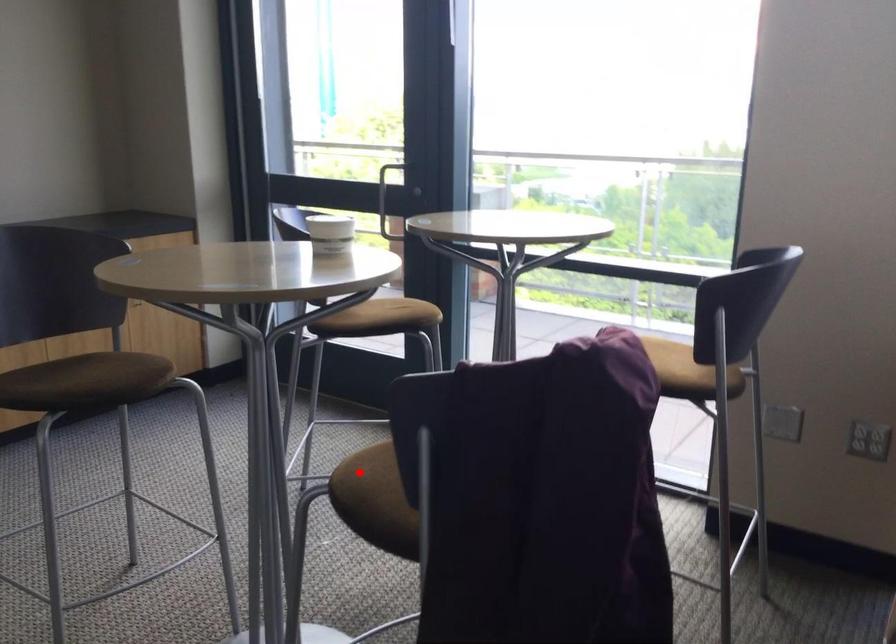
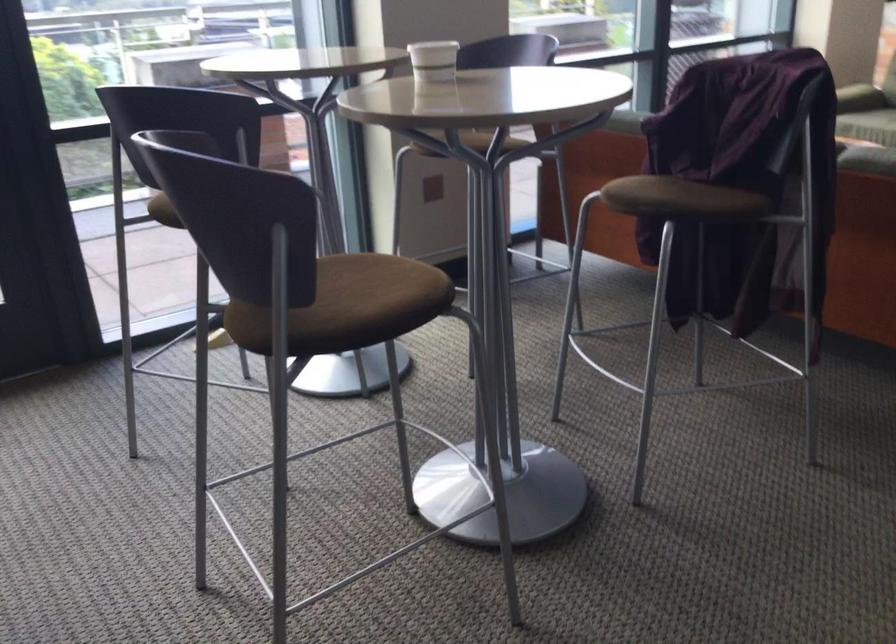
Question: I am providing you with two images of the same scene from different viewpoints. Image1 has a red point marked. In image2, the corresponding 3D location appears at what relative position? Reply with the corresponding letter.

Choices:
 (A) Closer
 (B) Farther

Answer: (B)